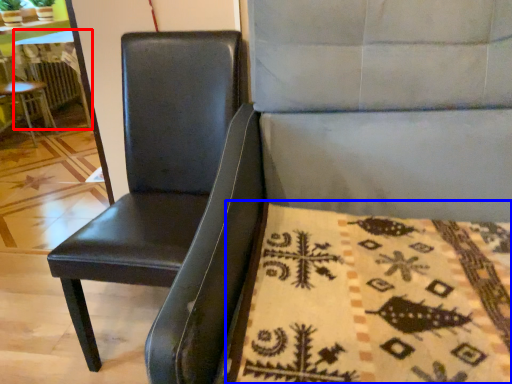
Question: Which object appears farthest to the camera in this image, table (highlighted by a red box) or blanket (highlighted by a blue box)?

Choices:
 (A) table
 (B) blanket

Answer: (A)